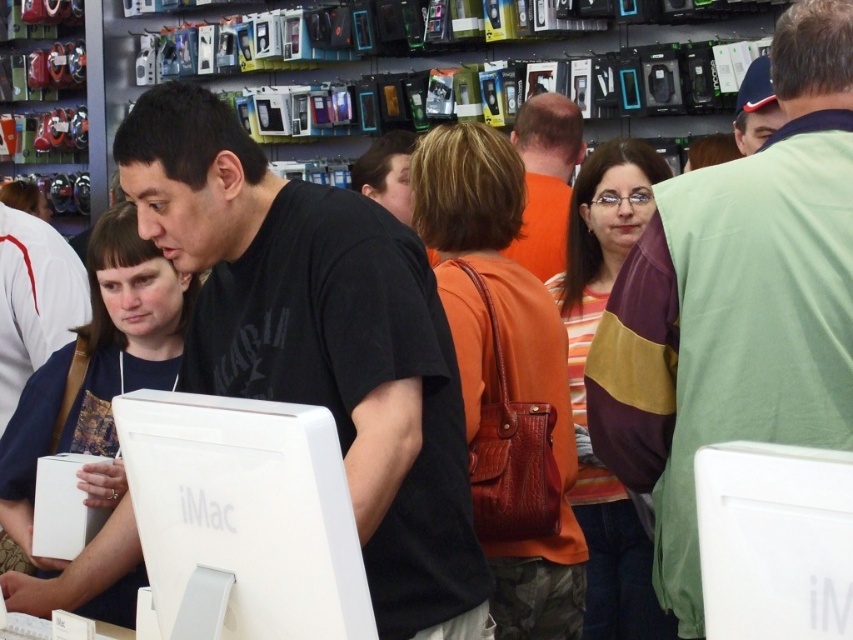
Question: Is white matte imac at center smaller than orange fabric shirt at center?

Choices:
 (A) no
 (B) yes

Answer: (B)

Question: Is black matte shirt at center to the left of blue fabric cap at upper right from the viewer's perspective?

Choices:
 (A) no
 (B) yes

Answer: (B)

Question: Is black matte shirt at center wider than white glossy imac at center?

Choices:
 (A) yes
 (B) no

Answer: (A)

Question: Which object appears farthest from the camera in this image?

Choices:
 (A) white glossy imac at center
 (B) black matte shirt at center

Answer: (B)

Question: Which point appears closest to the camera in this image?

Choices:
 (A) (653, 419)
 (B) (318, 188)

Answer: (B)

Question: Which of the following is the farthest from the observer?

Choices:
 (A) white matte imac at center
 (B) green fabric shirt at center
 (C) blue fabric cap at upper right

Answer: (C)